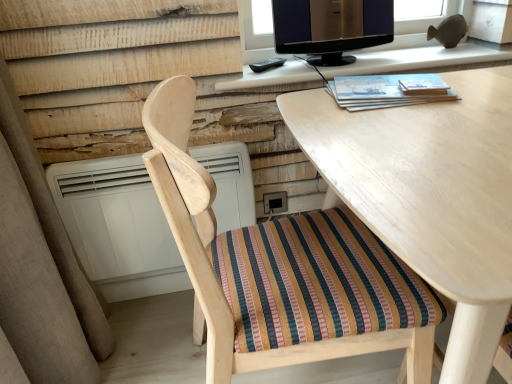
What do you see at coordinates (283, 269) in the screenshot? I see `wooden chair with striped cushion at center` at bounding box center [283, 269].

What do you see at coordinates (118, 226) in the screenshot?
I see `white plastic air conditioner at lower left` at bounding box center [118, 226].

This screenshot has height=384, width=512. What are the coordinates of `light wood desk at center` in the screenshot? It's located at (430, 195).

This screenshot has width=512, height=384. I want to click on wooden chair with striped cushion at center, so click(x=283, y=269).

Is matte black monitor at upper center positioned behind black glossy monitor at upper center?

Yes.

Is matte black monitor at upper center oriented towards black glossy monitor at upper center?

No, matte black monitor at upper center is not oriented towards black glossy monitor at upper center.

Considering the sizes of objects matte black monitor at upper center and black glossy monitor at upper center in the image provided, who is thinner, matte black monitor at upper center or black glossy monitor at upper center?

Thinner between the two is black glossy monitor at upper center.

Which is correct: matte black monitor at upper center is inside black glossy monitor at upper center, or outside of it?

matte black monitor at upper center is not inside black glossy monitor at upper center, it's outside.

Which is behind, light wood desk at center or matte black monitor at upper center?

matte black monitor at upper center is more distant.

Is light wood desk at center facing away from matte black monitor at upper center?

Yes, light wood desk at center's orientation is away from matte black monitor at upper center.

From the image's perspective, is light wood desk at center located above matte black monitor at upper center?

Actually, light wood desk at center appears below matte black monitor at upper center in the image.

Considering the relative sizes of light wood desk at center and black glossy monitor at upper center in the image provided, is light wood desk at center smaller than black glossy monitor at upper center?

Actually, light wood desk at center might be larger than black glossy monitor at upper center.

Is point (499, 272) farther from camera compared to point (289, 22)?

No, it is in front of (289, 22).

Which object is more forward, light wood desk at center or black glossy monitor at upper center?

Positioned in front is light wood desk at center.

From the picture: Measure the distance between light wood desk at center and black glossy monitor at upper center.

The distance of light wood desk at center from black glossy monitor at upper center is 54.84 centimeters.

Is white plastic air conditioner at lower left wider than matte black monitor at upper center?

No, white plastic air conditioner at lower left is not wider than matte black monitor at upper center.

From a real-world perspective, is white plastic air conditioner at lower left above or below matte black monitor at upper center?

white plastic air conditioner at lower left is below matte black monitor at upper center.

Is white plastic air conditioner at lower left surrounding matte black monitor at upper center?

No, white plastic air conditioner at lower left does not contain matte black monitor at upper center.

Is light wood desk at center facing away from wooden chair with striped cushion at center?

No, light wood desk at center is not facing the opposite direction of wooden chair with striped cushion at center.

Looking at this image, from a real-world perspective, which object rests below the other?

light wood desk at center is physically lower.

Would you say light wood desk at center is outside wooden chair with striped cushion at center?

Absolutely, light wood desk at center is external to wooden chair with striped cushion at center.

Does black glossy monitor at upper center appear on the left side of light wood desk at center?

Yes, black glossy monitor at upper center is to the left of light wood desk at center.

Is black glossy monitor at upper center bigger than light wood desk at center?

No, black glossy monitor at upper center is not bigger than light wood desk at center.

Do you think black glossy monitor at upper center is within light wood desk at center, or outside of it?

black glossy monitor at upper center is located beyond the bounds of light wood desk at center.

Is black glossy monitor at upper center turned away from light wood desk at center?

No, black glossy monitor at upper center is not facing away from light wood desk at center.

Would you say white plastic air conditioner at lower left is inside or outside light wood desk at center?

The correct answer is: outside.

From a real-world perspective, is white plastic air conditioner at lower left physically below light wood desk at center?

Incorrect, from a real-world perspective, white plastic air conditioner at lower left is higher than light wood desk at center.

In the scene shown: Could you tell me if white plastic air conditioner at lower left is facing light wood desk at center?

No, white plastic air conditioner at lower left does not turn towards light wood desk at center.

Locate an element on the screen. The width and height of the screenshot is (512, 384). computer desk on the right of the black glossy monitor at upper center is located at coordinates (421, 59).

At what (x,y) coordinates should I click in order to perform the action: click on computer desk that is above the light wood desk at center (from a real-world perspective). Please return your answer as a coordinate pair (x, y). The image size is (512, 384). Looking at the image, I should click on (421, 59).

When comparing their distances from matte black monitor at upper center, does light wood desk at center or wooden chair with striped cushion at center seem closer?

light wood desk at center lies closer to matte black monitor at upper center than the other object.

Looking at the image, which one is located further to black glossy monitor at upper center, matte black monitor at upper center or wooden chair with striped cushion at center?

Among the two, wooden chair with striped cushion at center is located further to black glossy monitor at upper center.

From the image, which object appears to be farther from black glossy monitor at upper center, matte black monitor at upper center or light wood desk at center?

light wood desk at center lies further to black glossy monitor at upper center than the other object.

Based on their spatial positions, is white plastic air conditioner at lower left or light wood desk at center closer to black glossy monitor at upper center?

Among the two, light wood desk at center is located nearer to black glossy monitor at upper center.

Considering their positions, is white plastic air conditioner at lower left positioned closer to matte black monitor at upper center than black glossy monitor at upper center?

Among the two, black glossy monitor at upper center is located nearer to matte black monitor at upper center.

Based on their spatial positions, is black glossy monitor at upper center or light wood desk at center closer to matte black monitor at upper center?

The object closer to matte black monitor at upper center is black glossy monitor at upper center.

Which object lies further to the anchor point white plastic air conditioner at lower left, black glossy monitor at upper center or light wood desk at center?

The object further to white plastic air conditioner at lower left is black glossy monitor at upper center.

Based on their spatial positions, is wooden chair with striped cushion at center or black glossy monitor at upper center further from matte black monitor at upper center?

wooden chair with striped cushion at center is further to matte black monitor at upper center.

Locate an element on the screen. The image size is (512, 384). air conditioner between wooden chair with striped cushion at center and matte black monitor at upper center along the z-axis is located at coordinates (118, 226).

Where is `computer monitor between wooden chair with striped cushion at center and matte black monitor at upper center from front to back`? The image size is (512, 384). computer monitor between wooden chair with striped cushion at center and matte black monitor at upper center from front to back is located at coordinates (331, 27).

Where is `chair between light wood desk at center and black glossy monitor at upper center along the z-axis`? The height and width of the screenshot is (384, 512). chair between light wood desk at center and black glossy monitor at upper center along the z-axis is located at coordinates [x=283, y=269].

In order to click on computer monitor between light wood desk at center and matte black monitor at upper center from front to back in this screenshot , I will do `click(331, 27)`.